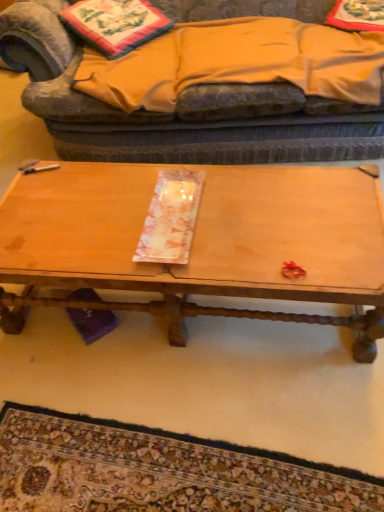
Question: Is orange cotton blanket at upper center taller than wooden tray at center?

Choices:
 (A) yes
 (B) no

Answer: (B)

Question: Is orange cotton blanket at upper center shorter than wooden tray at center?

Choices:
 (A) no
 (B) yes

Answer: (B)

Question: Does orange cotton blanket at upper center lie in front of wooden tray at center?

Choices:
 (A) yes
 (B) no

Answer: (B)

Question: Is wooden tray at center at the back of orange cotton blanket at upper center?

Choices:
 (A) yes
 (B) no

Answer: (B)

Question: Is orange cotton blanket at upper center behind wooden tray at center?

Choices:
 (A) no
 (B) yes

Answer: (B)

Question: Considering the relative sizes of orange cotton blanket at upper center and wooden tray at center in the image provided, is orange cotton blanket at upper center thinner than wooden tray at center?

Choices:
 (A) no
 (B) yes

Answer: (A)

Question: From a real-world perspective, is carpet with intricate patterns at lower center over velvet fabric studio couch at upper center?

Choices:
 (A) no
 (B) yes

Answer: (A)

Question: Can you confirm if carpet with intricate patterns at lower center is thinner than velvet fabric studio couch at upper center?

Choices:
 (A) no
 (B) yes

Answer: (B)

Question: Is carpet with intricate patterns at lower center positioned with its back to velvet fabric studio couch at upper center?

Choices:
 (A) no
 (B) yes

Answer: (A)

Question: Would you consider carpet with intricate patterns at lower center to be distant from velvet fabric studio couch at upper center?

Choices:
 (A) yes
 (B) no

Answer: (A)

Question: Is carpet with intricate patterns at lower center taller than velvet fabric studio couch at upper center?

Choices:
 (A) no
 (B) yes

Answer: (A)

Question: Is the position of carpet with intricate patterns at lower center more distant than that of velvet fabric studio couch at upper center?

Choices:
 (A) yes
 (B) no

Answer: (B)

Question: Is carpet with intricate patterns at lower center directly adjacent to wooden tray at center?

Choices:
 (A) yes
 (B) no

Answer: (B)